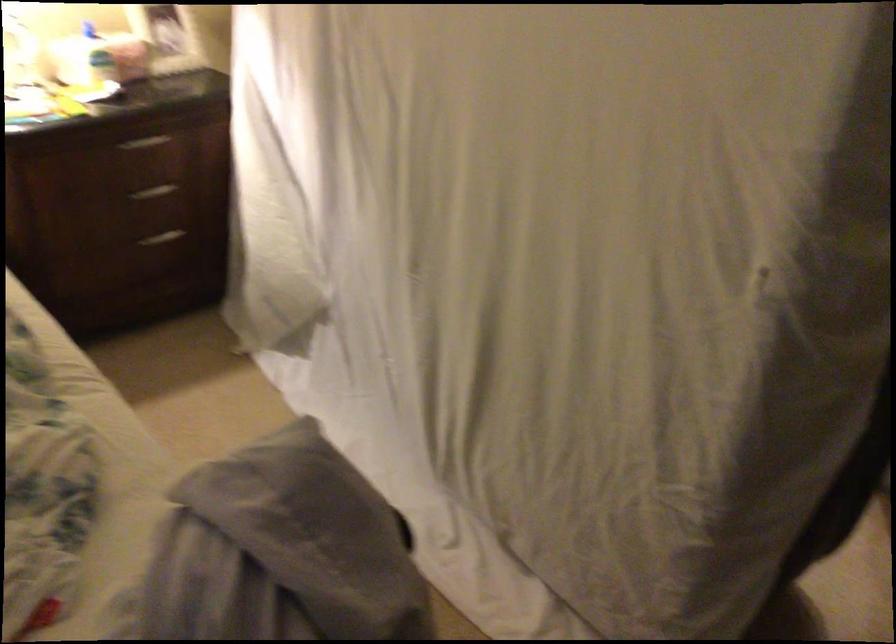
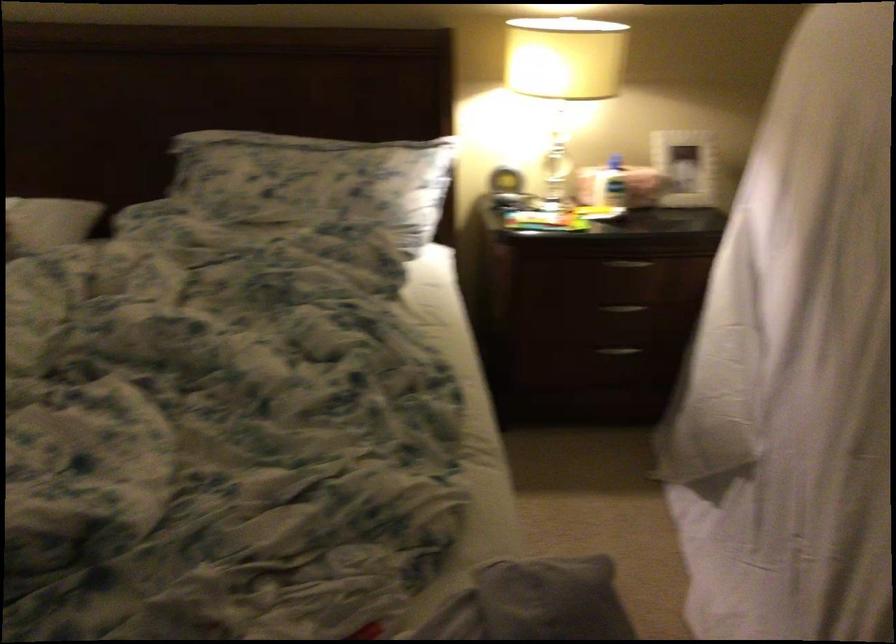
The point at (x=95, y=68) is marked in the first image. Where is the corresponding point in the second image?

(609, 184)